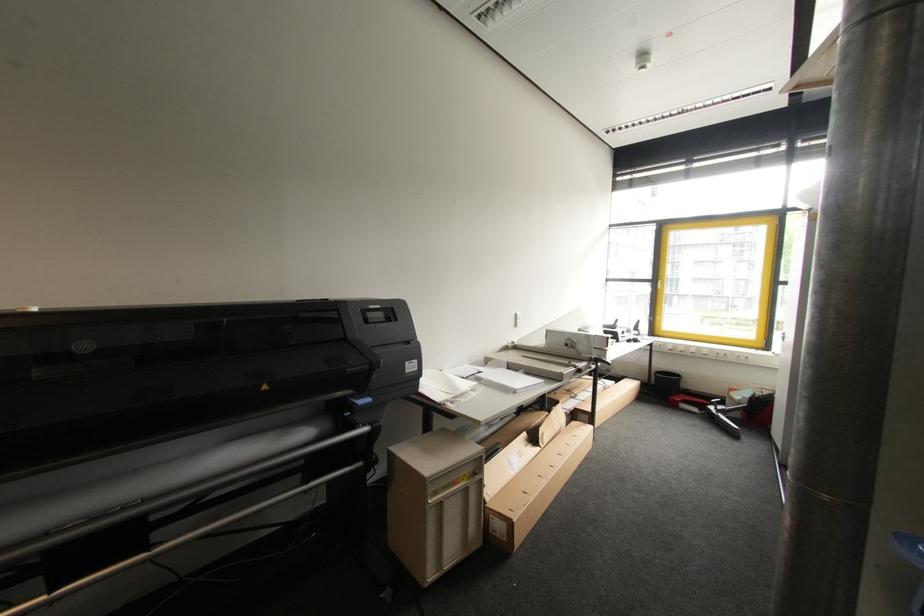
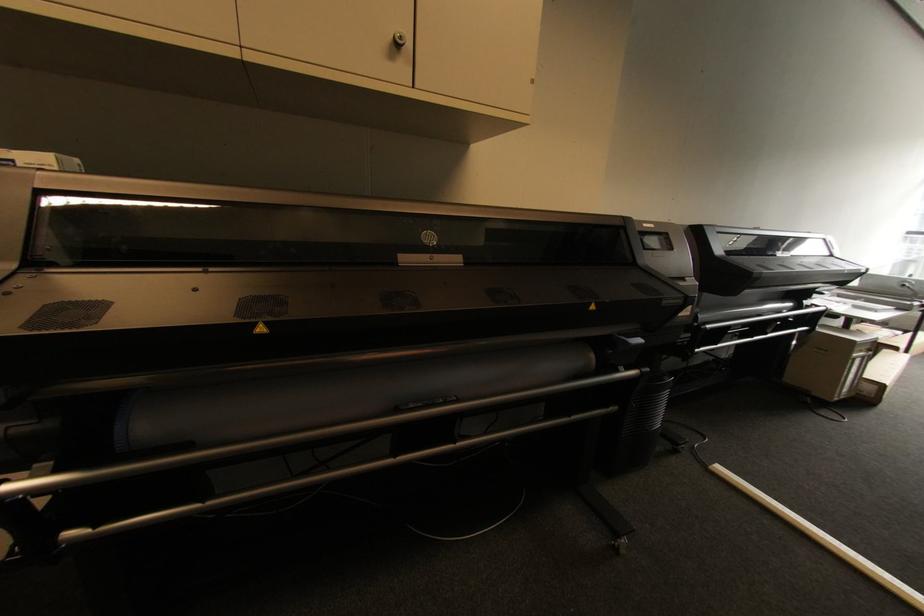
The images are taken continuously from a first-person perspective. In which direction are you moving?

The cameraman moved toward left, backward.